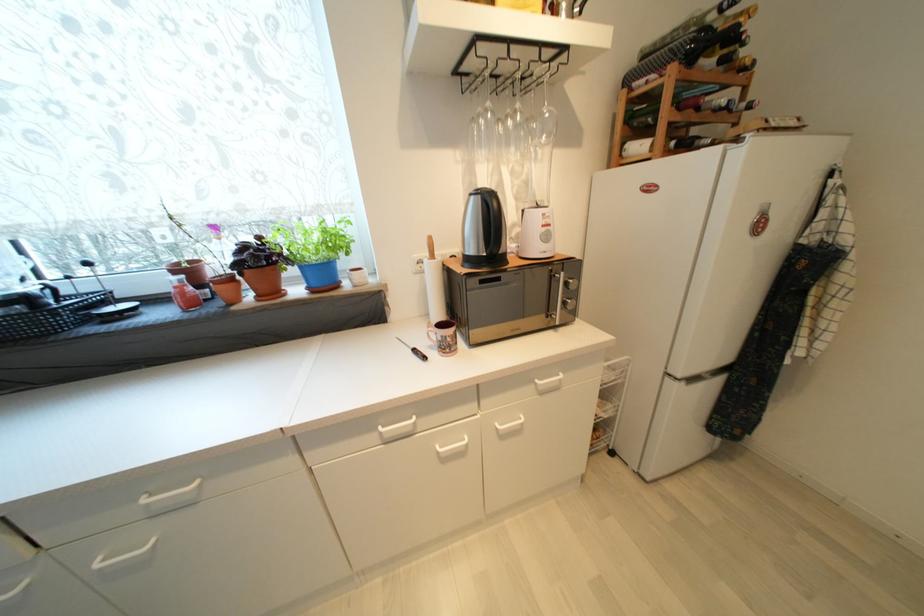
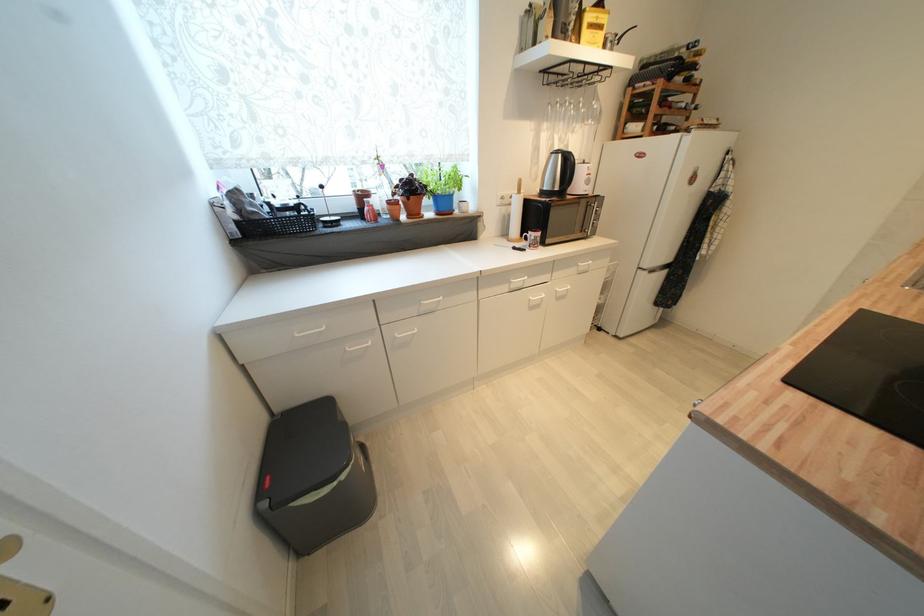
The point at (511, 416) is marked in the first image. Where is the corresponding point in the second image?

(566, 285)